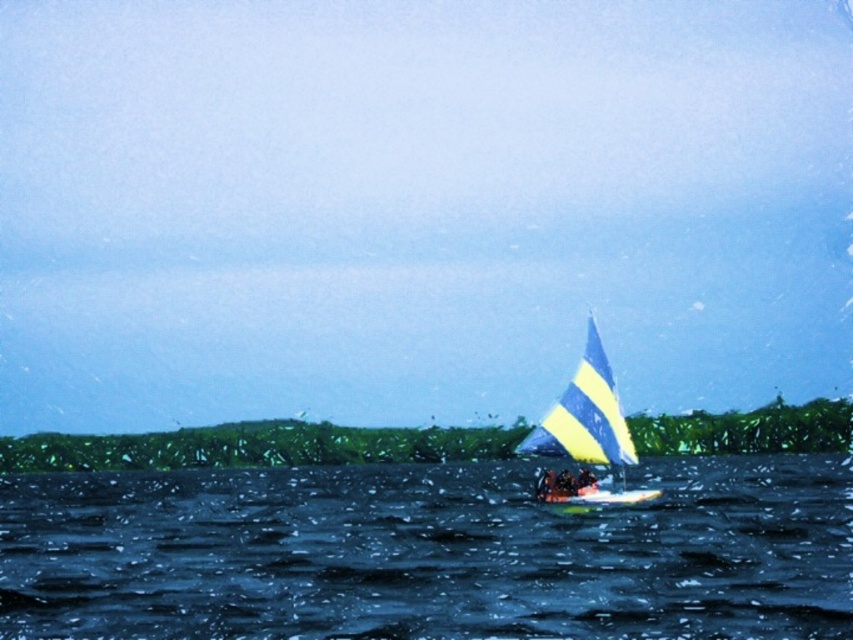
Based on the provided scene description, where is the smooth skin person at center located in terms of coordinates?

The smooth skin person at center is located at coordinates point (566, 483).

You are standing on the dock and see the yellow striped sailboat at center and the smooth skin person at center. Which object is located to the right of the other?

The yellow striped sailboat at center is positioned on the right side of smooth skin person at center.

You are standing on the shore of the lake and see the dark blue water at center and the smooth skin person at center. Which object is located to the right of the other?

The dark blue water at center is positioned on the right side of smooth skin person at center.